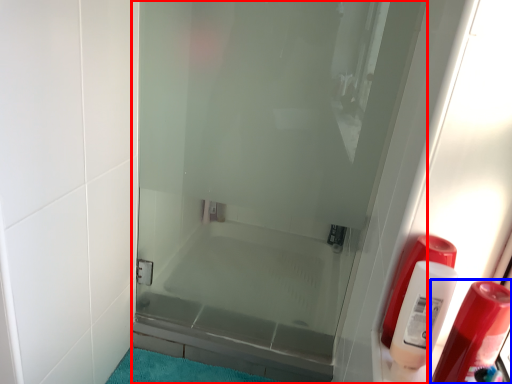
Question: Which of the following is the closest to the observer, door (highlighted by a red box) or soap dispenser (highlighted by a blue box)?

Choices:
 (A) door
 (B) soap dispenser

Answer: (B)